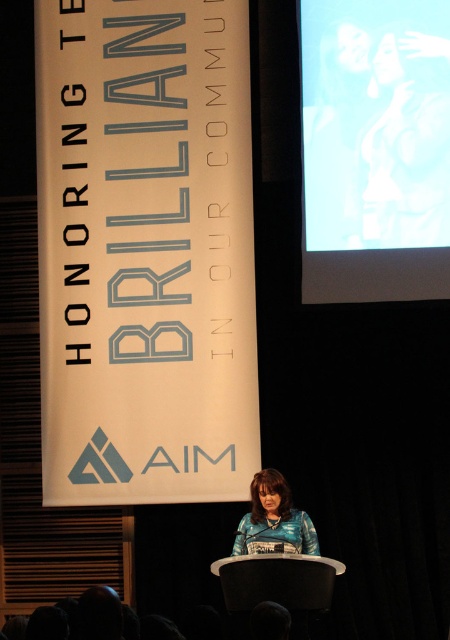
You are an event photographer at the formal event. You need to position your camera to capture the speaker and the screen. Where should you place your camera to ensure both the speaker and the white glossy screen at upper right are in frame?

The white glossy screen at upper right is located at point (x=374, y=148), so you should position your camera to capture both the speaker and the screen by aiming towards that coordinate.

You are an event photographer who needs to capture a photo of the blue textured shirt at center and the white glossy screen at upper right. Which object should you zoom in on to ensure both are clearly visible in the frame?

The white glossy screen at upper right is bigger than the blue textured shirt at center, so you should zoom in on the blue textured shirt at center to ensure both are clearly visible in the frame.